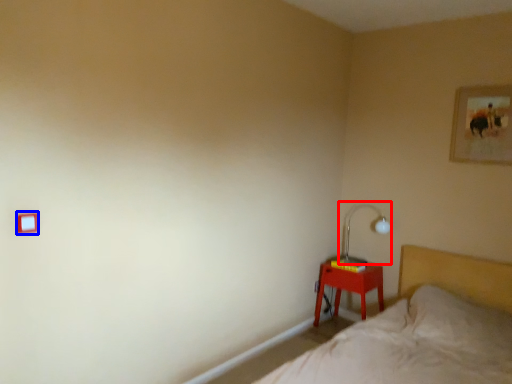
Question: Among these objects, which one is farthest to the camera, table lamp (highlighted by a red box) or light switch (highlighted by a blue box)?

Choices:
 (A) table lamp
 (B) light switch

Answer: (A)